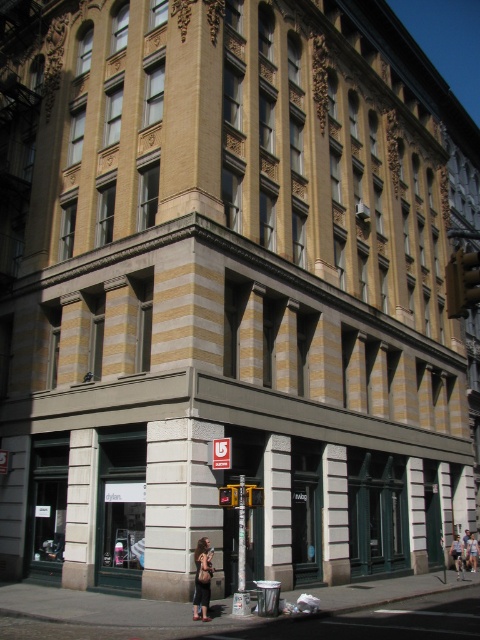
Question: Which object is farther from the camera taking this photo?

Choices:
 (A) white stone pillar at lower left
 (B) denim jacket at lower right

Answer: (B)

Question: Which point is farther to the camera?

Choices:
 (A) (476, 570)
 (B) (78, 452)

Answer: (A)

Question: Does white stone pillar at lower left come behind denim jacket at lower right?

Choices:
 (A) no
 (B) yes

Answer: (A)

Question: Is white stone pillar at lower left smaller than denim jacket at lower right?

Choices:
 (A) no
 (B) yes

Answer: (B)

Question: Which of the following is the closest to the observer?

Choices:
 (A) pos(454,540)
 (B) pos(478,554)

Answer: (B)

Question: In this image, where is dark brown leather jacket at lower center located relative to denim jacket at lower right?

Choices:
 (A) above
 (B) below

Answer: (A)